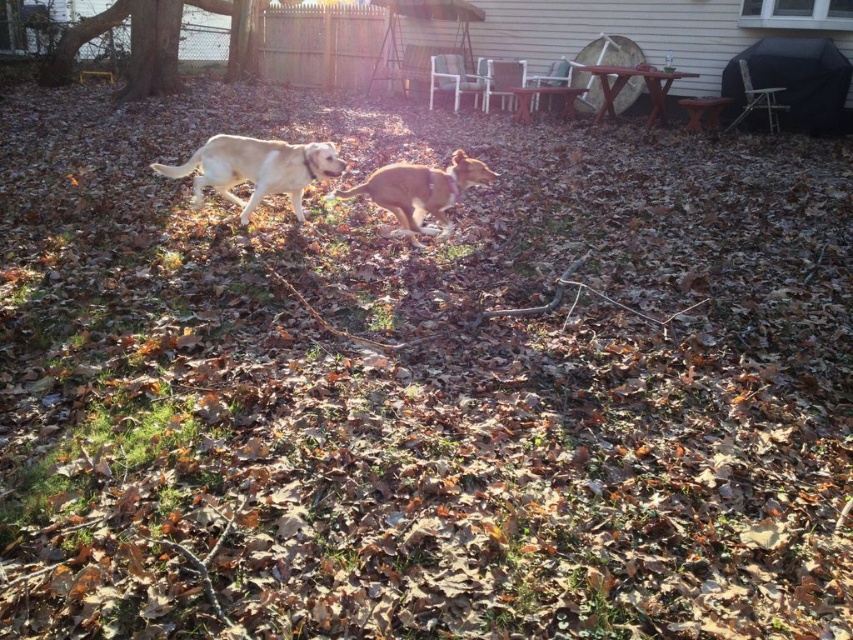
Is golden fur dog at center below golden brown fur at center?

No, golden fur dog at center is not below golden brown fur at center.

Does golden fur dog at center appear on the right side of golden brown fur at center?

Incorrect, golden fur dog at center is not on the right side of golden brown fur at center.

Based on the photo, who is more distant from viewer, (231,186) or (405,225)?

Point (231,186)

Where is `golden fur dog at center`? golden fur dog at center is located at coordinates (256, 168).